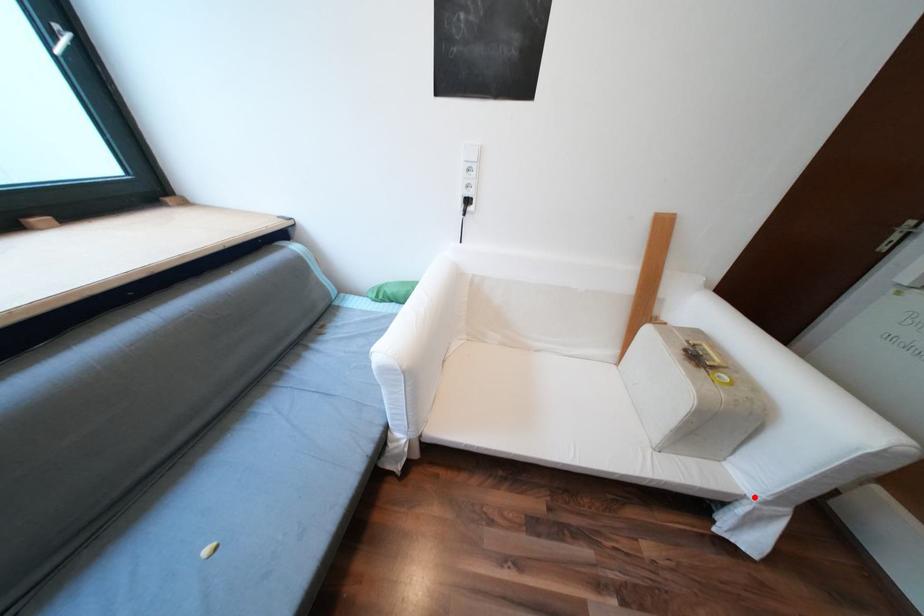
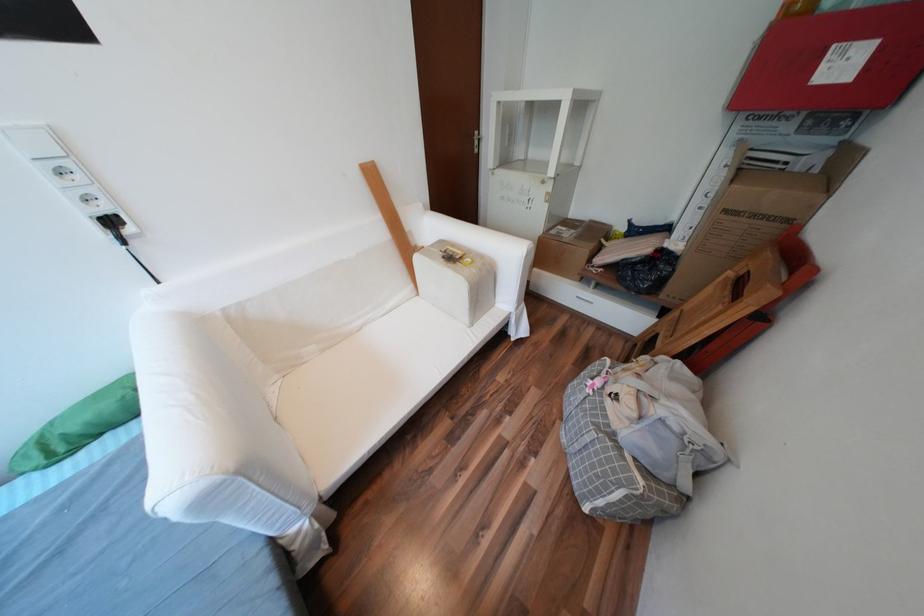
In the second image, find the point that corresponds to the highlighted location in the first image.

(519, 313)